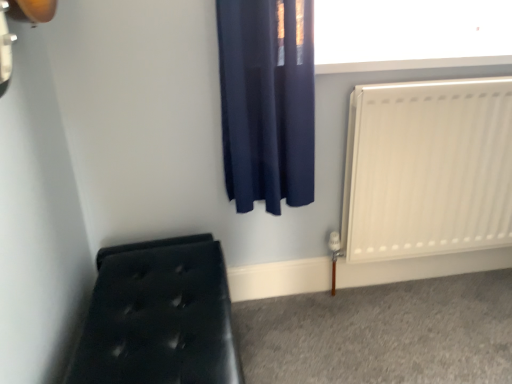
Question: Does black tufted bench at lower left appear on the left side of white matte radiator at right?

Choices:
 (A) yes
 (B) no

Answer: (A)

Question: Can you confirm if black tufted bench at lower left is smaller than white matte radiator at right?

Choices:
 (A) no
 (B) yes

Answer: (A)

Question: Is black tufted bench at lower left in contact with white matte radiator at right?

Choices:
 (A) no
 (B) yes

Answer: (A)

Question: From the image's perspective, is black tufted bench at lower left above white matte radiator at right?

Choices:
 (A) yes
 (B) no

Answer: (B)

Question: Does black tufted bench at lower left have a larger size compared to white matte radiator at right?

Choices:
 (A) yes
 (B) no

Answer: (A)

Question: In terms of width, does white matte radiator at right look wider or thinner when compared to white smooth window sill at upper center?

Choices:
 (A) wide
 (B) thin

Answer: (B)

Question: Considering their positions, is white matte radiator at right located in front of or behind white smooth window sill at upper center?

Choices:
 (A) behind
 (B) front

Answer: (B)

Question: Considering the positions of white matte radiator at right and white smooth window sill at upper center in the image, is white matte radiator at right taller or shorter than white smooth window sill at upper center?

Choices:
 (A) tall
 (B) short

Answer: (A)

Question: Considering the positions of point (348, 160) and point (397, 61), is point (348, 160) closer or farther from the camera than point (397, 61)?

Choices:
 (A) farther
 (B) closer

Answer: (A)

Question: From a real-world perspective, is white matte radiator at right above or below black tufted bench at lower left?

Choices:
 (A) above
 (B) below

Answer: (A)

Question: From their relative heights in the image, would you say white matte radiator at right is taller or shorter than black tufted bench at lower left?

Choices:
 (A) short
 (B) tall

Answer: (B)

Question: Is white matte radiator at right wider or thinner than black tufted bench at lower left?

Choices:
 (A) thin
 (B) wide

Answer: (A)

Question: Looking at the image, does white matte radiator at right seem bigger or smaller compared to black tufted bench at lower left?

Choices:
 (A) big
 (B) small

Answer: (B)

Question: Looking at their shapes, would you say dark blue fabric curtain at upper center is wider or thinner than black tufted bench at lower left?

Choices:
 (A) wide
 (B) thin

Answer: (B)

Question: Is dark blue fabric curtain at upper center in front of or behind black tufted bench at lower left in the image?

Choices:
 (A) behind
 (B) front

Answer: (A)